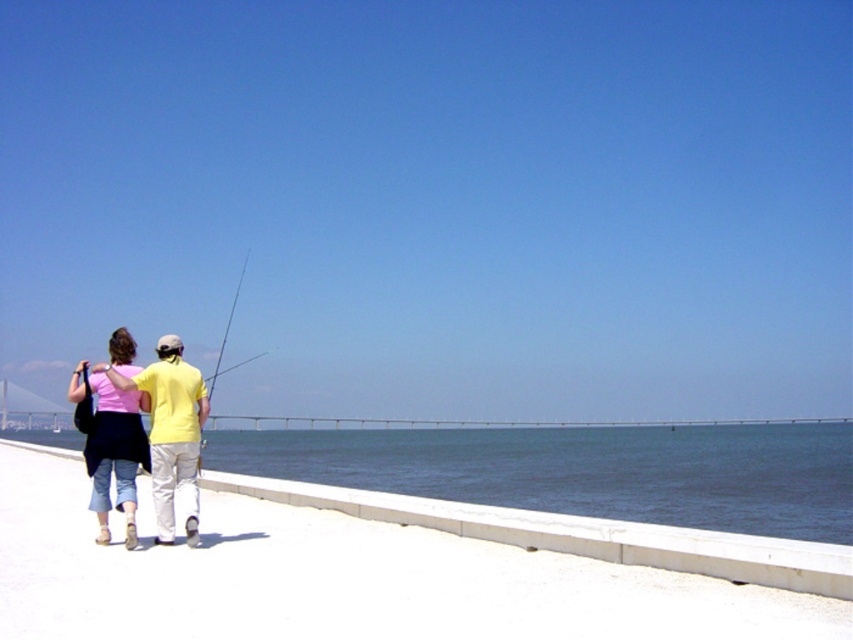
In the scene shown: Who is more forward, (x=94, y=467) or (x=218, y=360)?

Point (x=94, y=467) is more forward.

Locate an element on the screen. pink fabric at center is located at coordinates (143, 433).

Describe the element at coordinates (343, 579) in the screenshot. This screenshot has height=640, width=853. I see `white concrete wall at lower center` at that location.

Where is `white concrete wall at lower center`? Image resolution: width=853 pixels, height=640 pixels. white concrete wall at lower center is located at coordinates (343, 579).

Is white concrete wall at lower center shorter than matte yellow fishing pole at center?

Correct, white concrete wall at lower center is not as tall as matte yellow fishing pole at center.

Does white concrete wall at lower center appear under matte yellow fishing pole at center?

No, white concrete wall at lower center is not below matte yellow fishing pole at center.

Identify the location of white concrete wall at lower center. [343, 579].

Where is `white concrete wall at lower center`? The height and width of the screenshot is (640, 853). white concrete wall at lower center is located at coordinates (343, 579).